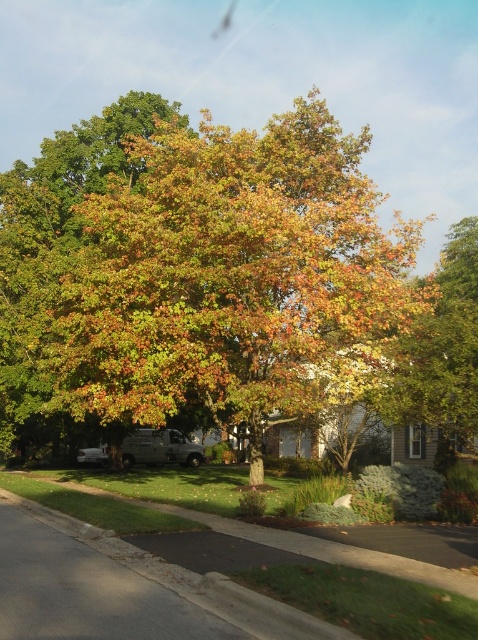
You are standing in the suburban scene looking at the large tree. There are two points marked on the tree trunk. The first point is at coordinates point (x=263, y=136) and the second point is at point (x=102, y=173). Which point is closer to you?

Point (x=263, y=136) is further to the viewer than point (x=102, y=173), so the second point is closer to you.

You are standing at the point marked by the coordinates point (229,275). What is the nearest object to you in the scene?

The nearest object to you at point (229,275) is the multicolored foliage at center, as the coordinates correspond to its location.